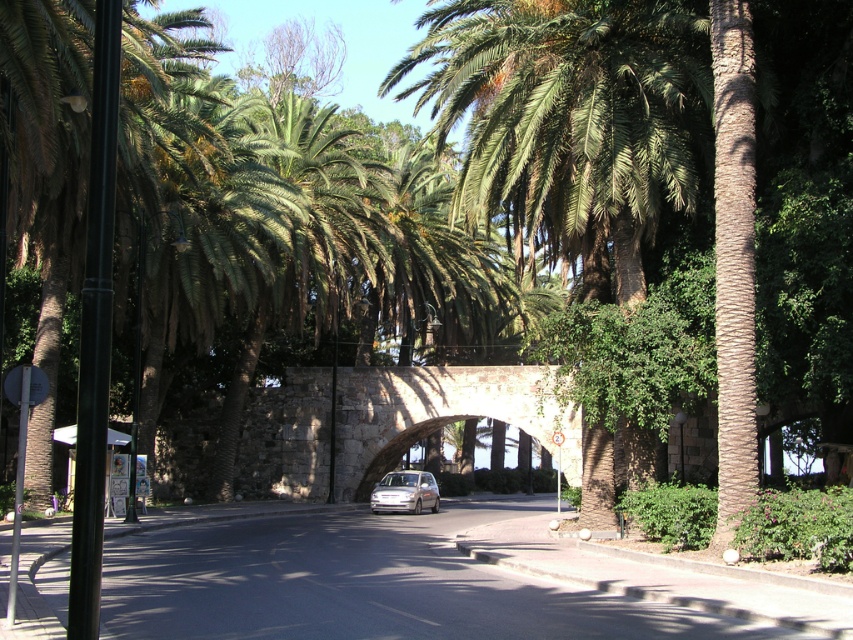
You are a pedestrian standing on the road under the stone archway at center. Looking up, you see the green leafy palm tree at center. Is the palm tree above or below the archway?

The green leafy palm tree at center is above the stone archway at center, so it is positioned above the archway.

Looking at this image, you are a photographer planning to take a photo of the stone archway at center and the satin silver car at center from the side of the road. Considering their heights, which object will appear larger in the photo?

The stone archway at center is much taller than the satin silver car at center, so it will appear larger in the photo.

You are driving a car and want to park under the stone archway at center. The satin silver car at center is currently blocking the entrance. Can you drive around it on the left side to access the archway?

The stone archway at center is to the right of the satin silver car at center, so you can drive around the left side of the satin silver car at center to access the archway.